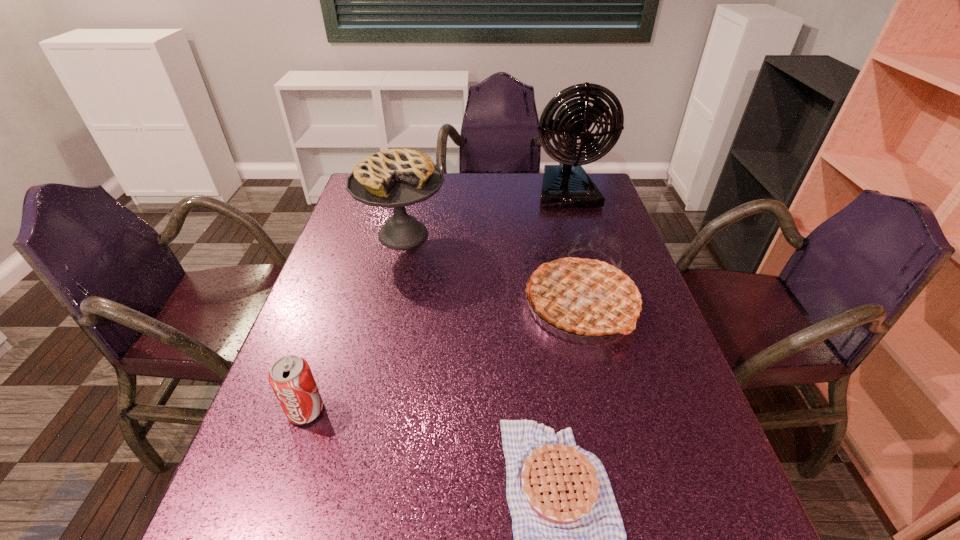
Identify the location of the tallest object. The height and width of the screenshot is (540, 960). (568, 185).

Where is `the leftmost pie`? This screenshot has height=540, width=960. the leftmost pie is located at coordinates (395, 178).

I want to click on the second nearest pie, so click(586, 296).

In order to click on the fourth tallest object in this screenshot , I will do `click(290, 377)`.

This screenshot has height=540, width=960. I want to click on vacant area situated 0.140m in front of the tallest object to blow air, so click(580, 237).

Locate an element on the screen. The image size is (960, 540). free space located on the cut side of the farthest pie is located at coordinates (378, 342).

Find the location of `vacant space located 0.270m on the front of the second nearest pie`. vacant space located 0.270m on the front of the second nearest pie is located at coordinates (620, 466).

At what (x,y) coordinates should I click in order to perform the action: click on vacant space located 0.090m on the front of the soda can. Please return your answer as a coordinate pair (x, y). Looking at the image, I should click on (284, 473).

Find the location of `object that is positioned at the far edge`. object that is positioned at the far edge is located at coordinates click(568, 185).

Find the location of a particular element. This screenshot has height=540, width=960. pie that is at the left edge is located at coordinates (395, 178).